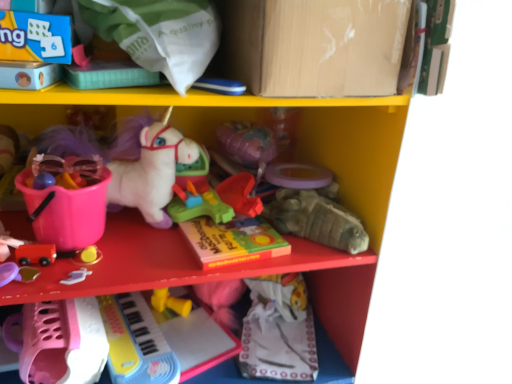
What do you see at coordinates (316, 220) in the screenshot? I see `matte gray turtle at center right, which is counted as the 4th toy, starting from the bottom` at bounding box center [316, 220].

Find the location of a particular element. yellow rubber toy at lower center, the second toy ordered from the bottom is located at coordinates (170, 302).

What is the approximate width of smooth wooden car at lower left, the fourth toy when ordered from top to bottom?

1.63 inches.

What do you see at coordinates (240, 194) in the screenshot? I see `rubberized plastic toy at center, which is the sixth toy from bottom to top` at bounding box center [240, 194].

Where is `matte plastic book at center`? matte plastic book at center is located at coordinates (233, 241).

Identify the location of rubberized plastic toy at center, arranged as the 5th toy when ordered from the bottom. The image size is (512, 384). (198, 205).

Considering the sizes of matte cardboard box at upper center and smooth wooden car at lower left, which is the third toy from bottom to top, in the image, is matte cardboard box at upper center bigger or smaller than smooth wooden car at lower left, which is the third toy from bottom to top,?

Considering their sizes, matte cardboard box at upper center takes up more space than smooth wooden car at lower left, which is the third toy from bottom to top.

Is there a large distance between matte cardboard box at upper center and smooth wooden car at lower left, which is the third toy from bottom to top?

No.

Considering the sizes of objects matte cardboard box at upper center and smooth wooden car at lower left, the fourth toy when ordered from top to bottom, in the image provided, who is thinner, matte cardboard box at upper center or smooth wooden car at lower left, the fourth toy when ordered from top to bottom,?

Thinner between the two is smooth wooden car at lower left, the fourth toy when ordered from top to bottom.

From the image's perspective, which one is positioned lower, matte cardboard box at upper center or smooth wooden car at lower left, the fourth toy when ordered from top to bottom?

smooth wooden car at lower left, the fourth toy when ordered from top to bottom, is shown below in the image.

Would you say pink plastic bucket at left is a long distance from matte gray turtle at center right, positioned as the third toy in top-to-bottom order?

No, pink plastic bucket at left is not far away from matte gray turtle at center right, positioned as the third toy in top-to-bottom order.

Between pink plastic bucket at left and matte gray turtle at center right, which is counted as the 4th toy, starting from the bottom, which one is positioned behind?

matte gray turtle at center right, which is counted as the 4th toy, starting from the bottom, is further away from the camera.

Which is more to the right, pink plastic bucket at left or matte gray turtle at center right, positioned as the third toy in top-to-bottom order?

matte gray turtle at center right, positioned as the third toy in top-to-bottom order.

Between pink plastic bucket at left and matte gray turtle at center right, which is counted as the 4th toy, starting from the bottom, which one has more height?

pink plastic bucket at left is taller.

Where is `box above the rubberized plastic toy at center, which is the sixth toy from bottom to top (from the image's perspective)`? This screenshot has height=384, width=512. box above the rubberized plastic toy at center, which is the sixth toy from bottom to top (from the image's perspective) is located at coordinates (67, 212).

How far apart are rubberized plastic toy at center, positioned as the 1th toy in top-to-bottom order, and pink plastic bucket at left?

The distance of rubberized plastic toy at center, positioned as the 1th toy in top-to-bottom order, from pink plastic bucket at left is 31.43 centimeters.

From the image's perspective, is rubberized plastic toy at center, positioned as the 1th toy in top-to-bottom order, above pink plastic bucket at left?

Incorrect, from the image's perspective, rubberized plastic toy at center, positioned as the 1th toy in top-to-bottom order, is lower than pink plastic bucket at left.

Based on their positions, is rubberized plastic toy at center, which is the sixth toy from bottom to top, located to the left or right of pink plastic bucket at left?

From the image, it's evident that rubberized plastic toy at center, which is the sixth toy from bottom to top, is to the right of pink plastic bucket at left.

Measure the distance from rubberized plastic toy at center, arranged as the 5th toy when ordered from the bottom, to matte gray turtle at center right, positioned as the third toy in top-to-bottom order.

rubberized plastic toy at center, arranged as the 5th toy when ordered from the bottom, and matte gray turtle at center right, positioned as the third toy in top-to-bottom order, are 6.60 inches apart.

What's the angular difference between rubberized plastic toy at center, which is the second toy from top to bottom, and matte gray turtle at center right, positioned as the third toy in top-to-bottom order,'s facing directions?

0.183 degrees.

Considering the relative sizes of rubberized plastic toy at center, arranged as the 5th toy when ordered from the bottom, and matte gray turtle at center right, which is counted as the 4th toy, starting from the bottom, in the image provided, is rubberized plastic toy at center, arranged as the 5th toy when ordered from the bottom, shorter than matte gray turtle at center right, which is counted as the 4th toy, starting from the bottom,?

Indeed, rubberized plastic toy at center, arranged as the 5th toy when ordered from the bottom, has a lesser height compared to matte gray turtle at center right, which is counted as the 4th toy, starting from the bottom.

Which is more to the right, rubberized plastic toy at center, arranged as the 5th toy when ordered from the bottom, or matte gray turtle at center right, positioned as the third toy in top-to-bottom order?

Positioned to the right is matte gray turtle at center right, positioned as the third toy in top-to-bottom order.

From the image's perspective, between matte cardboard box at upper center and matte plastic book at center, which one is located above?

matte cardboard box at upper center appears higher in the image.

Is matte cardboard box at upper center positioned before matte plastic book at center?

That is True.

Is the surface of matte cardboard box at upper center in direct contact with matte plastic book at center?

No, matte cardboard box at upper center is not beside matte plastic book at center.

Considering the positions of objects pink plastic bucket at left and rubberized plastic toy at center, positioned as the 1th toy in top-to-bottom order, in the image provided, who is more to the left, pink plastic bucket at left or rubberized plastic toy at center, positioned as the 1th toy in top-to-bottom order,?

Positioned to the left is pink plastic bucket at left.

Would you say pink plastic bucket at left is inside or outside rubberized plastic toy at center, positioned as the 1th toy in top-to-bottom order?

pink plastic bucket at left cannot be found inside rubberized plastic toy at center, positioned as the 1th toy in top-to-bottom order.

Starting from the pink plastic bucket at left, which toy is the 4th one to the right? Please provide its 2D coordinates.

[(240, 194)]

Locate an element on the screen. the 1st toy in front of the rubberized plastic toy at center, positioned as the 1th toy in top-to-bottom order is located at coordinates (198, 205).

Is rubberized plastic toy at center, arranged as the 5th toy when ordered from the bottom, positioned behind rubberized plastic toy at center, positioned as the 1th toy in top-to-bottom order?

No, rubberized plastic toy at center, arranged as the 5th toy when ordered from the bottom, is in front of rubberized plastic toy at center, positioned as the 1th toy in top-to-bottom order.

From the image's perspective, is rubberized plastic toy at center, which is the second toy from top to bottom, above or below rubberized plastic toy at center, positioned as the 1th toy in top-to-bottom order?

Based on their image positions, rubberized plastic toy at center, which is the second toy from top to bottom, is located beneath rubberized plastic toy at center, positioned as the 1th toy in top-to-bottom order.

From a real-world perspective, is rubberized plastic toy at center, arranged as the 5th toy when ordered from the bottom, above or below rubberized plastic toy at center, which is the sixth toy from bottom to top?

rubberized plastic toy at center, arranged as the 5th toy when ordered from the bottom, is situated lower than rubberized plastic toy at center, which is the sixth toy from bottom to top, in the real world.

From the image's perspective, starting from the matte cardboard box at upper center, which toy is the 4th one below? Please provide its 2D coordinates.

[(35, 254)]

Locate an element on the screen. The image size is (512, 384). box positioned vertically above the matte gray turtle at center right, which is counted as the 4th toy, starting from the bottom (from a real-world perspective) is located at coordinates (67, 212).

Which object lies further to the anchor point matte cardboard box at upper center, yellow rubber toy at lower center, which is counted as the 5th toy, starting from the top, or smooth wooden car at lower left, the fourth toy when ordered from top to bottom?

yellow rubber toy at lower center, which is counted as the 5th toy, starting from the top, is positioned further to the anchor matte cardboard box at upper center.

When comparing their distances from plastic yellow keyboard at lower center, the sixth toy from the top, does matte plastic book at center or matte gray turtle at center right, positioned as the third toy in top-to-bottom order, seem further?

The object further to plastic yellow keyboard at lower center, the sixth toy from the top, is matte gray turtle at center right, positioned as the third toy in top-to-bottom order.

From the image, which object appears to be farther from rubberized plastic toy at center, positioned as the 1th toy in top-to-bottom order, matte gray turtle at center right, positioned as the third toy in top-to-bottom order, or pink plastic bucket at left?

Among the two, pink plastic bucket at left is located further to rubberized plastic toy at center, positioned as the 1th toy in top-to-bottom order.

Based on their spatial positions, is matte gray turtle at center right, positioned as the third toy in top-to-bottom order, or plastic yellow keyboard at lower center, the sixth toy from the top, further from yellow rubber toy at lower center, the second toy ordered from the bottom?

matte gray turtle at center right, positioned as the third toy in top-to-bottom order, is positioned further to the anchor yellow rubber toy at lower center, the second toy ordered from the bottom.

Which object lies nearer to the anchor point smooth wooden car at lower left, which is the third toy from bottom to top, matte plastic book at center or rubberized plastic toy at center, positioned as the 1th toy in top-to-bottom order?

Based on the image, matte plastic book at center appears to be nearer to smooth wooden car at lower left, which is the third toy from bottom to top.

When comparing their distances from rubberized plastic toy at center, which is the second toy from top to bottom, does rubberized plastic toy at center, positioned as the 1th toy in top-to-bottom order, or pink plastic bucket at left seem further?

pink plastic bucket at left is positioned further to the anchor rubberized plastic toy at center, which is the second toy from top to bottom.

Considering their positions, is matte plastic book at center positioned further to rubberized plastic toy at center, which is the second toy from top to bottom, than matte cardboard box at upper center?

Based on the image, matte cardboard box at upper center appears to be further to rubberized plastic toy at center, which is the second toy from top to bottom.

Estimate the real-world distances between objects in this image. Which object is further from matte gray turtle at center right, which is counted as the 4th toy, starting from the bottom, smooth wooden car at lower left, which is the third toy from bottom to top, or rubberized plastic toy at center, positioned as the 1th toy in top-to-bottom order?

The object further to matte gray turtle at center right, which is counted as the 4th toy, starting from the bottom, is smooth wooden car at lower left, which is the third toy from bottom to top.

Where is `book between pink plastic bucket at left and matte gray turtle at center right, positioned as the third toy in top-to-bottom order, from left to right`? The width and height of the screenshot is (512, 384). book between pink plastic bucket at left and matte gray turtle at center right, positioned as the third toy in top-to-bottom order, from left to right is located at coordinates (233, 241).

Where is `book located between plastic yellow keyboard at lower center, the first toy ordered from the bottom, and matte gray turtle at center right, which is counted as the 4th toy, starting from the bottom, in the left-right direction`? The width and height of the screenshot is (512, 384). book located between plastic yellow keyboard at lower center, the first toy ordered from the bottom, and matte gray turtle at center right, which is counted as the 4th toy, starting from the bottom, in the left-right direction is located at coordinates (233, 241).

Where is `cardboard box situated between smooth wooden car at lower left, the fourth toy when ordered from top to bottom, and matte gray turtle at center right, positioned as the third toy in top-to-bottom order, from left to right`? cardboard box situated between smooth wooden car at lower left, the fourth toy when ordered from top to bottom, and matte gray turtle at center right, positioned as the third toy in top-to-bottom order, from left to right is located at coordinates (314, 46).

Locate an element on the screen. book between smooth wooden car at lower left, the fourth toy when ordered from top to bottom, and yellow rubber toy at lower center, which is counted as the 5th toy, starting from the top, along the z-axis is located at coordinates (233, 241).